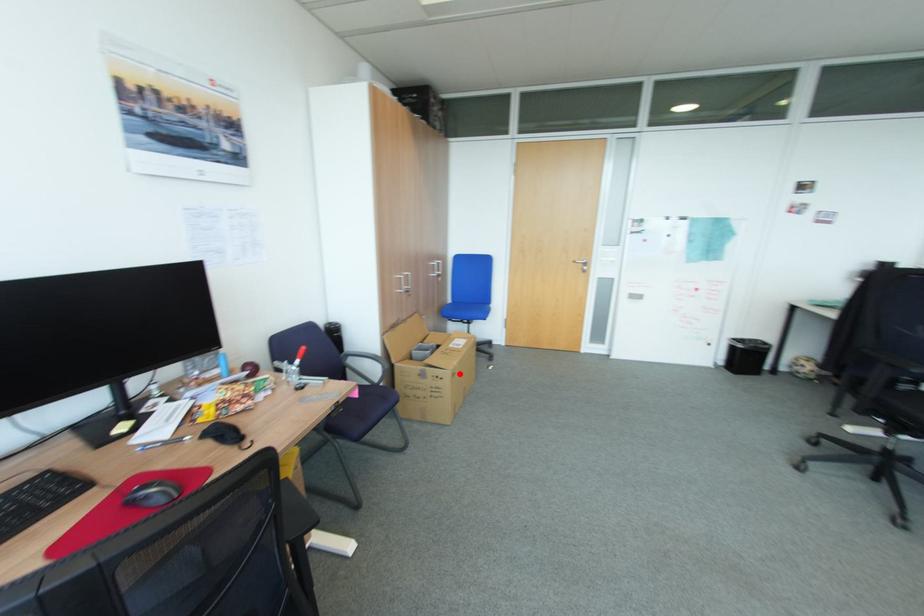
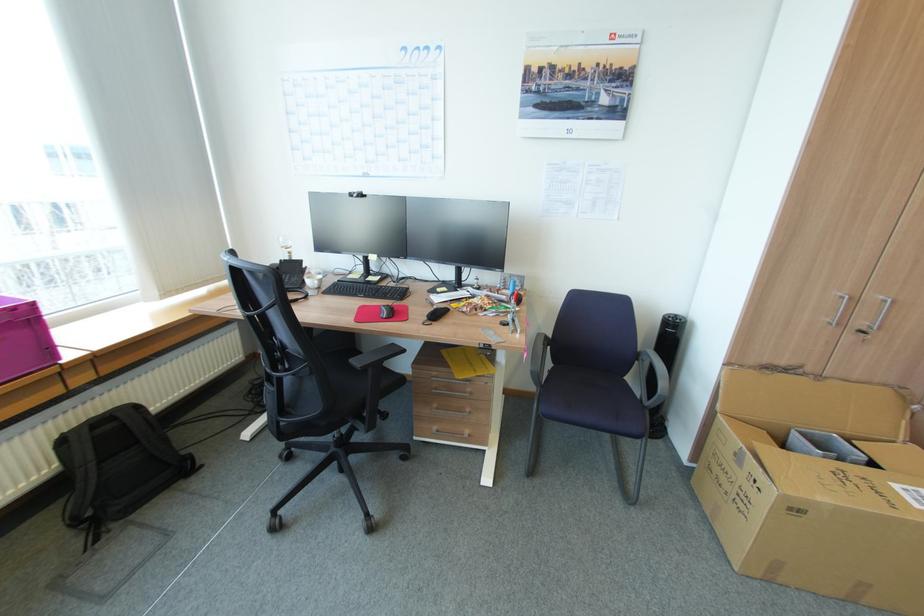
Question: I am providing you with two images of the same scene from different viewpoints. In image1, a red point is highlighted. Considering the same 3D point in image2, which of the following is correct?

Choices:
 (A) It is closer
 (B) It is farther

Answer: (A)